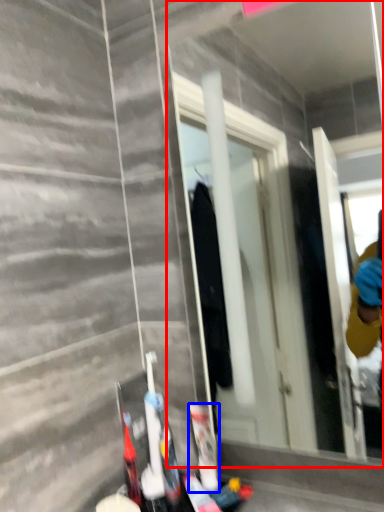
Question: Which point is further to the camera, mirror (highlighted by a red box) or toiletry (highlighted by a blue box)?

Choices:
 (A) mirror
 (B) toiletry

Answer: (B)